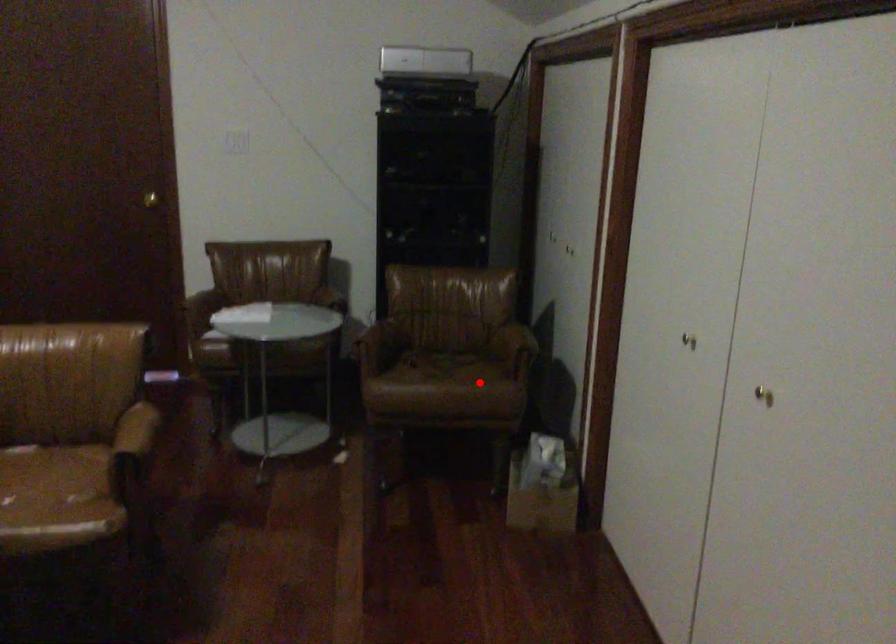
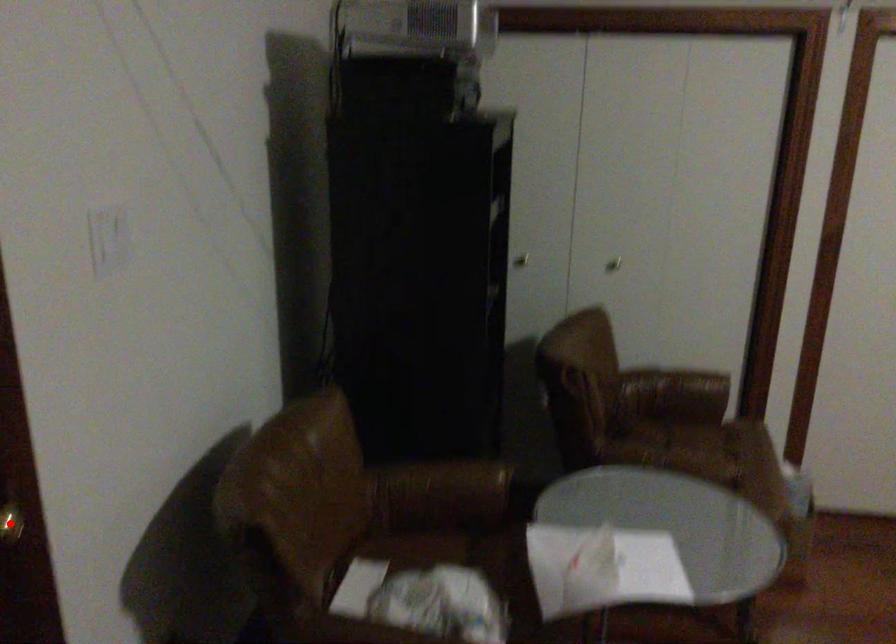
I am providing you with two images of the same scene from different viewpoints. A red point is marked on the first image and another point is marked on the second image. Does the point marked in image1 correspond to the same location as the one in image2?

No